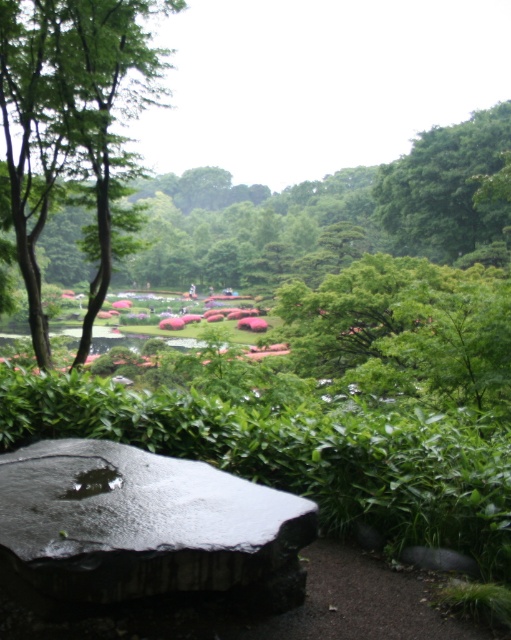
You are a landscape architect designing a walking path between the green leafy tree at left and the green leafy tree at upper right. The path must be straight and 3 meters wide. Can the path fit between them without bending around either tree?

The distance between the green leafy tree at left and the green leafy tree at upper right is 25.86 meters. Since the path only needs to be 3 meters wide, the straight path can easily fit between them without bending around either tree.

You are a gardener who needs to place a small decorative pot between the shiny black stone at lower left and the green leafy tree at upper right. Based on their sizes, which object should the pot be closer to?

The shiny black stone at lower left is smaller than the green leafy tree at upper right, so the pot should be placed closer to the shiny black stone at lower left to maintain visual balance between the two objects.

From the picture: You are standing in the garden and want to place a 2.5 meter long wooden bench. You see the shiny black stone at lower left. Is there enough space between you and the stone to place the bench?

The shiny black stone at lower left is 2.26 meters from the viewer. Since the bench is 2.5 meters long, it would extend beyond the distance to the stone, leaving insufficient space. Therefore, the bench cannot be placed there.